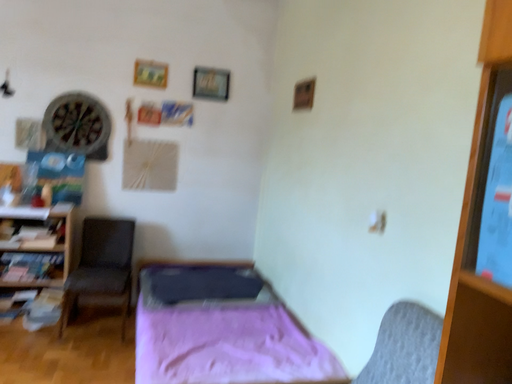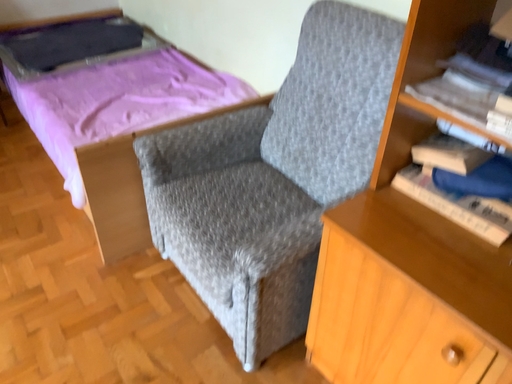
Question: Which way did the camera rotate in the video?

Choices:
 (A) rotated left
 (B) rotated right

Answer: (B)